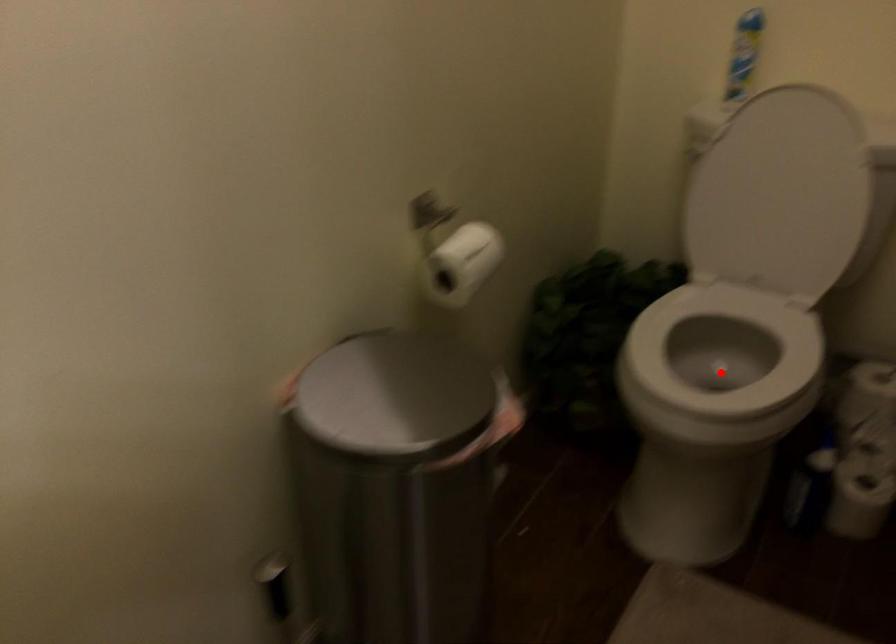
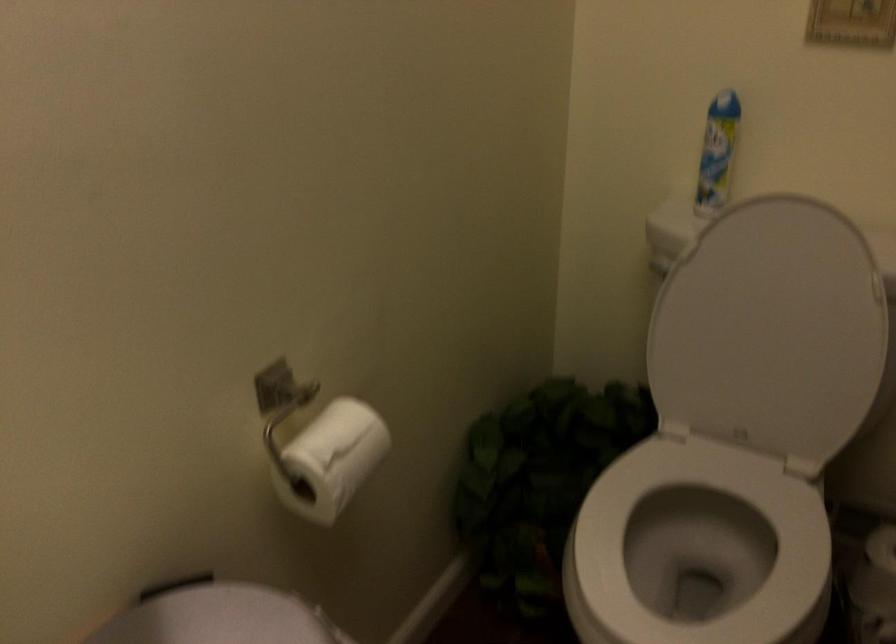
Question: I am providing you with two images of the same scene from different viewpoints. In image1, a red point is highlighted. Considering the same 3D point in image2, which of the following is correct?

Choices:
 (A) It is closer
 (B) It is farther

Answer: (A)